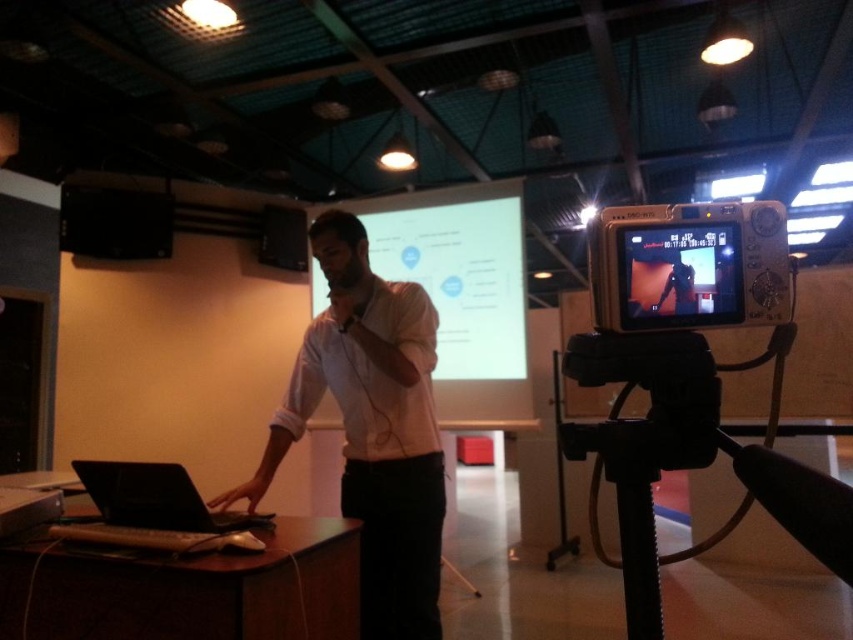
Question: Is matte black screen at upper right above matte black laptop at center?

Choices:
 (A) yes
 (B) no

Answer: (A)

Question: Which object is the closest to the black matte laptop at left?

Choices:
 (A) matte black screen at upper right
 (B) silver plastic video camera at center

Answer: (B)

Question: Which of these objects is positioned closest to the black matte laptop at left?

Choices:
 (A) white matte shirt at center
 (B) black plastic tripod at lower right

Answer: (A)

Question: Which object appears closest to the camera in this image?

Choices:
 (A) matte black screen at upper right
 (B) white matte shirt at center
 (C) white matte projection screen at center

Answer: (A)

Question: Does black plastic tripod at lower right have a lesser width compared to white matte projection screen at center?

Choices:
 (A) no
 (B) yes

Answer: (B)

Question: Is white matte projection screen at center thinner than matte black laptop at center?

Choices:
 (A) yes
 (B) no

Answer: (B)